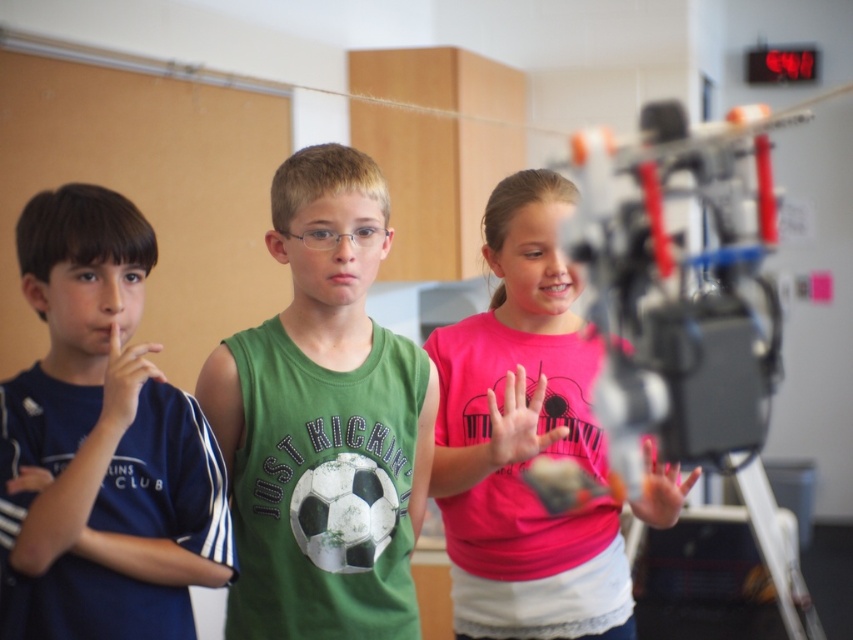
You are a teacher observing the children in the classroom. You notice the pink matte shirt at center and the pink matte hand at center. Which object is wider in the image?

The pink matte shirt at center is wider than the pink matte hand at center according to the description provided.

Based on the scene description, where is the matte skin hand at left located in terms of coordinates?

The matte skin hand at left is located at the coordinates point (125,381).